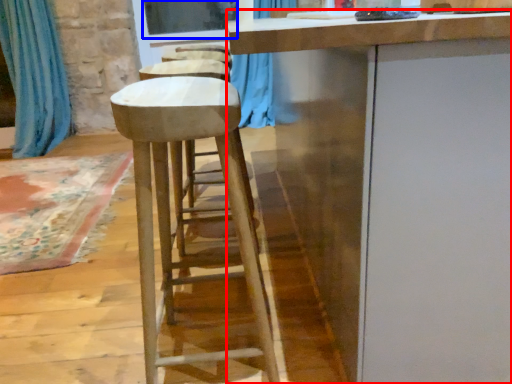
Question: Which object appears farthest to the camera in this image, cabinetry (highlighted by a red box) or window screen (highlighted by a blue box)?

Choices:
 (A) cabinetry
 (B) window screen

Answer: (B)